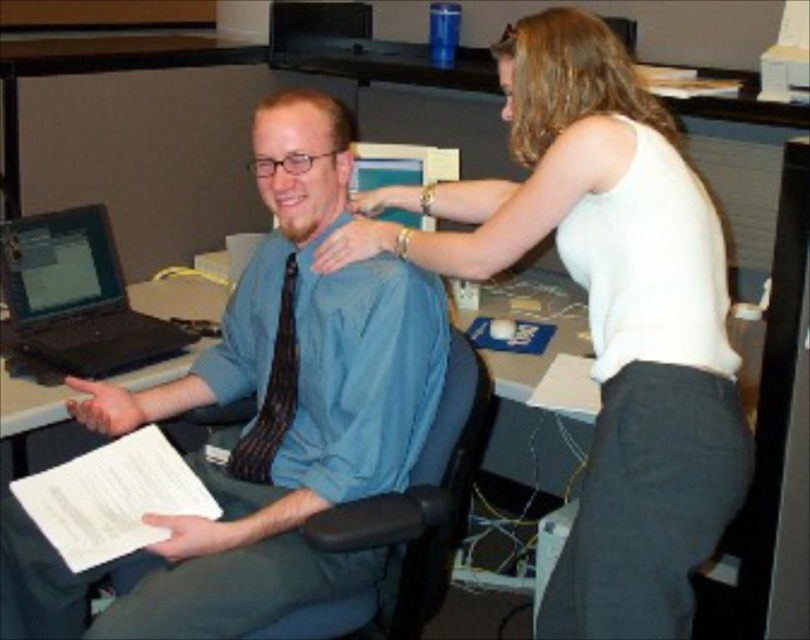
Can you confirm if blue shirt at center is smaller than black matte laptop at left?

Incorrect, blue shirt at center is not smaller in size than black matte laptop at left.

Between blue shirt at center and black matte laptop at left, which one has more height?

blue shirt at center is taller.

Which is behind, point (16, 560) or point (37, 269)?

Positioned behind is point (37, 269).

Locate an element on the screen. blue shirt at center is located at coordinates (265, 417).

Can you confirm if black matte laptop at left is thinner than striped fabric tie at center?

No, black matte laptop at left is not thinner than striped fabric tie at center.

Can you confirm if black matte laptop at left is smaller than striped fabric tie at center?

Actually, black matte laptop at left might be larger than striped fabric tie at center.

The height and width of the screenshot is (640, 810). Identify the location of black matte laptop at left. (75, 296).

Identify the location of black matte laptop at left. (75, 296).

Image resolution: width=810 pixels, height=640 pixels. Describe the element at coordinates (604, 314) in the screenshot. I see `white fabric shirt at upper right` at that location.

Looking at this image, can you confirm if white fabric shirt at upper right is positioned below striped fabric tie at center?

Incorrect, white fabric shirt at upper right is not positioned below striped fabric tie at center.

What do you see at coordinates (604, 314) in the screenshot? The image size is (810, 640). I see `white fabric shirt at upper right` at bounding box center [604, 314].

Image resolution: width=810 pixels, height=640 pixels. In order to click on white fabric shirt at upper right in this screenshot , I will do `click(604, 314)`.